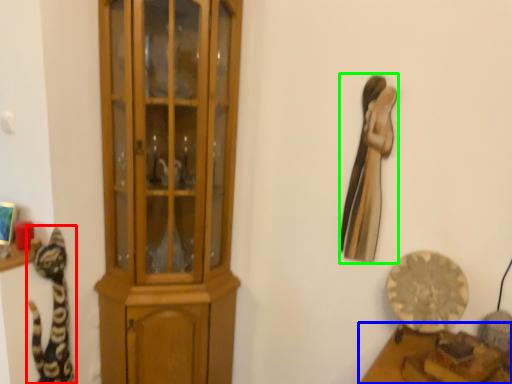
Question: Which object is the farthest from cat (highlighted by a red box)? Choose among these: furniture (highlighted by a blue box) or animal (highlighted by a green box).

Choices:
 (A) furniture
 (B) animal

Answer: (A)